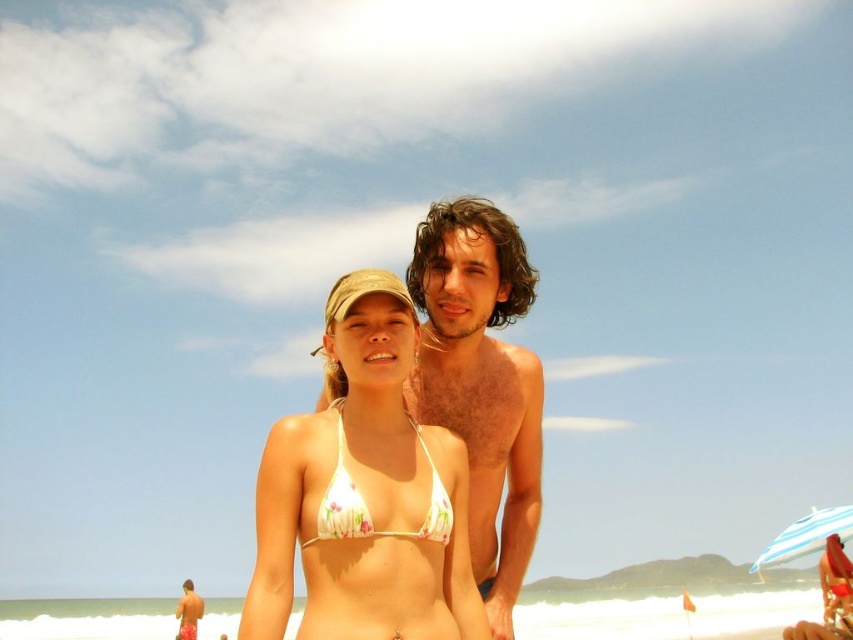
Does point (842, 508) lie in front of point (190, 605)?

That is True.

Where is `striped fabric umbrella at lower right`? striped fabric umbrella at lower right is located at coordinates 805,536.

In the scene shown: Does white floral bikini top at center have a lesser height compared to floral print bikini top at center?

No, white floral bikini top at center is not shorter than floral print bikini top at center.

Is point (410, 344) behind point (322, 506)?

That is True.

This screenshot has height=640, width=853. I want to click on white floral bikini top at center, so click(x=364, y=492).

What do you see at coordinates (366, 504) in the screenshot?
I see `floral print bikini top at center` at bounding box center [366, 504].

Which is in front, point (351, 516) or point (815, 518)?

Positioned in front is point (351, 516).

Where is `floral print bikini top at center`? The height and width of the screenshot is (640, 853). floral print bikini top at center is located at coordinates (366, 504).